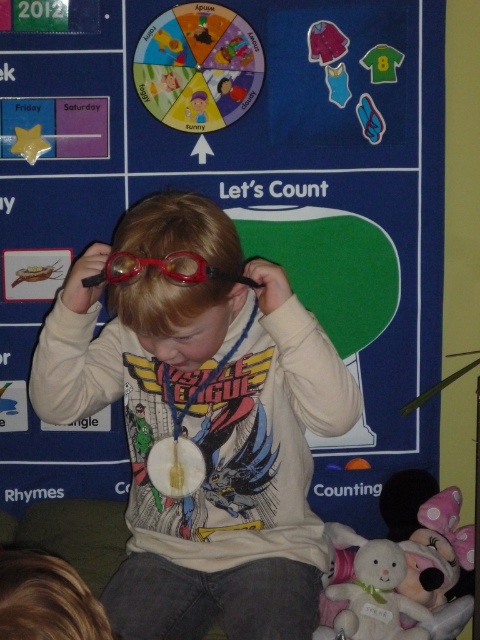
Question: Which point appears farthest from the camera in this image?

Choices:
 (A) (255, 264)
 (B) (99, 272)

Answer: (A)

Question: Is matte plastic goggles at center above translucent plastic goggles at center?

Choices:
 (A) yes
 (B) no

Answer: (B)

Question: Which object appears closest to the camera in this image?

Choices:
 (A) translucent plastic goggles at center
 (B) matte plastic goggles at center

Answer: (A)

Question: Is matte plastic goggles at center to the right of translucent plastic goggles at center from the viewer's perspective?

Choices:
 (A) yes
 (B) no

Answer: (A)

Question: Is matte plastic goggles at center bigger than translucent plastic goggles at center?

Choices:
 (A) yes
 (B) no

Answer: (A)

Question: Which object is closer to the camera taking this photo?

Choices:
 (A) translucent plastic goggles at center
 (B) matte plastic goggles at center

Answer: (A)